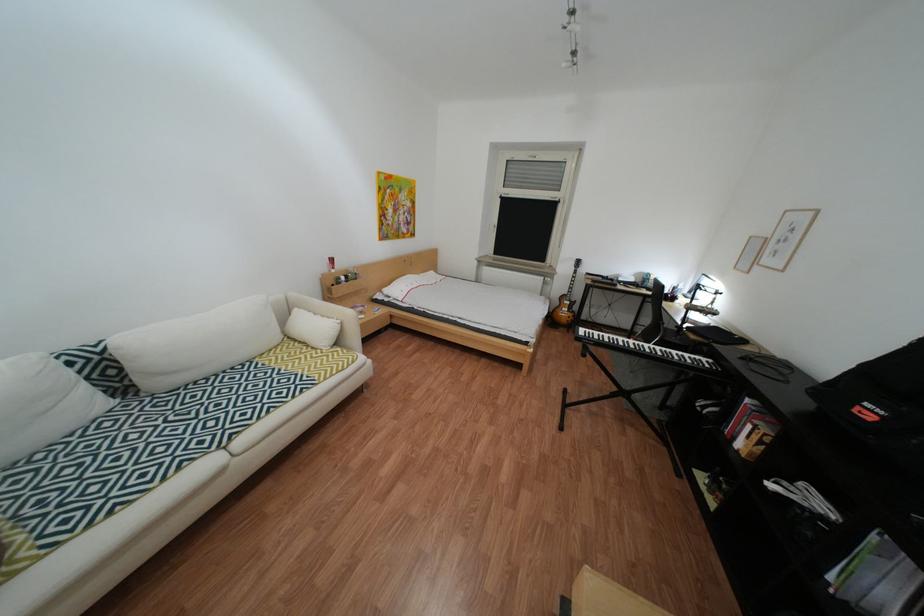
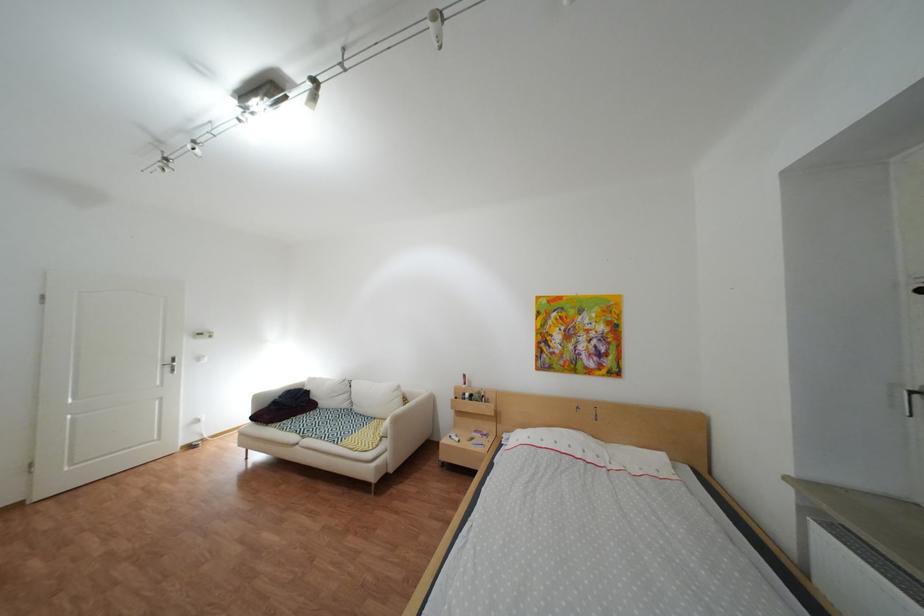
In the second image, find the point that corresponds to point 355,280 in the first image.

(480, 395)